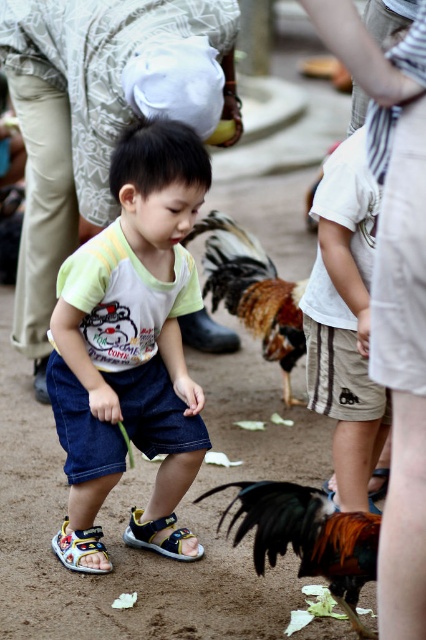
Question: Is denim shorts at center closer to camera compared to multicolored fabric sandal at lower left?

Choices:
 (A) yes
 (B) no

Answer: (A)

Question: Can you confirm if brown feathered rooster at center is thinner than blue fabric sandal at lower center?

Choices:
 (A) yes
 (B) no

Answer: (B)

Question: Among these points, which one is farthest from the camera?

Choices:
 (A) (178, 163)
 (B) (89, 547)
 (C) (138, 524)

Answer: (C)

Question: Can you confirm if blue fabric sandal at lower center is smaller than multicolored fabric sandal at lower left?

Choices:
 (A) no
 (B) yes

Answer: (A)

Question: Which object appears closest to the camera in this image?

Choices:
 (A) denim shorts at center
 (B) multicolored fabric sandal at lower left
 (C) blue fabric sandal at lower center
 (D) brown feathered rooster at center

Answer: (A)

Question: Among these objects, which one is nearest to the camera?

Choices:
 (A) blue fabric sandal at lower center
 (B) multicolored fabric sandal at lower left
 (C) brown feathered rooster at center
 (D) brown glossy rooster at center

Answer: (D)